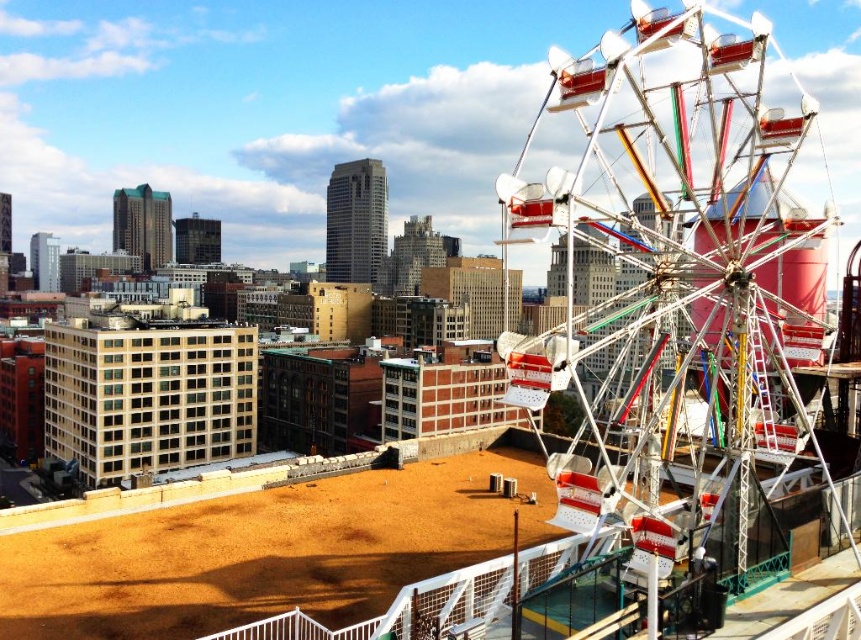
You are standing at the base of the Ferris wheel and want to walk towards the point labeled point (x=110, y=518). However, there is an obstacle at point labeled point (x=709, y=112). Will you be able to reach your destination without going around the obstacle?

Since point (x=709, y=112) is in front of point (x=110, y=518), the obstacle at point (x=709, y=112) will block your path. You will need to go around it to reach point (x=110, y=518).

You are standing at the camera position looking at the point at coordinates point (x=642, y=464). If you walk straight towards that point, how far will you have to walk to reach it?

The point at coordinates point (x=642, y=464) is 166.93 feet away from the camera, so you will have to walk 166.93 feet to reach it.

You are a construction worker standing on the brown sandy dirt field at lower center and want to reach the metallic ferris wheel at right. Which direction should you move to get there?

The metallic ferris wheel at right is positioned over the brown sandy dirt field at lower center, so you should move towards the right direction to reach it.